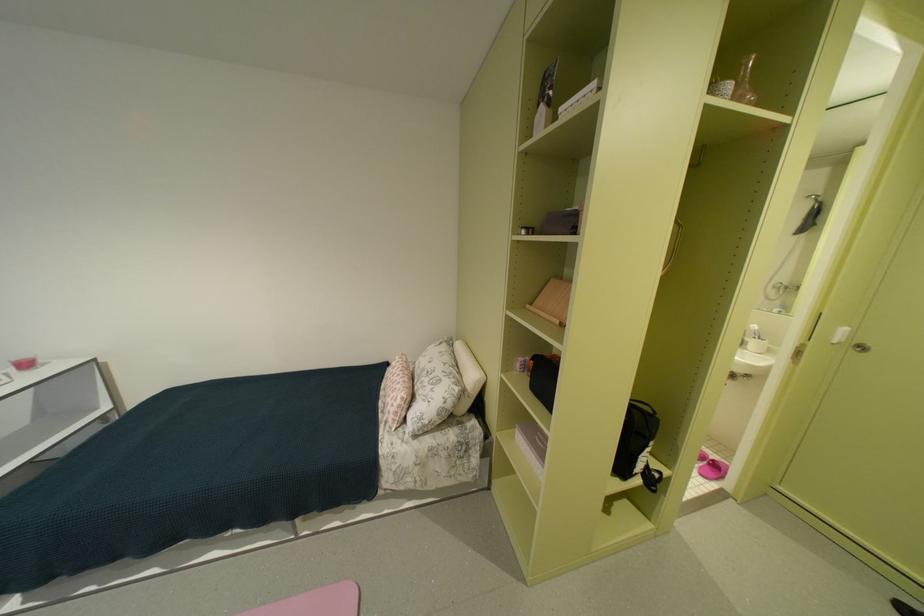
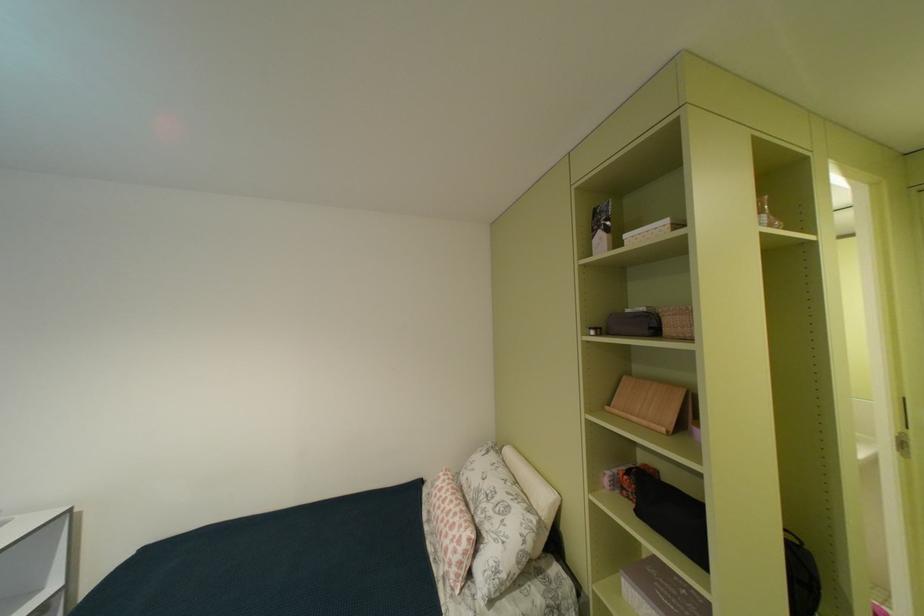
Find the pixel in the second image that matches [398,408] in the first image.

(458, 556)